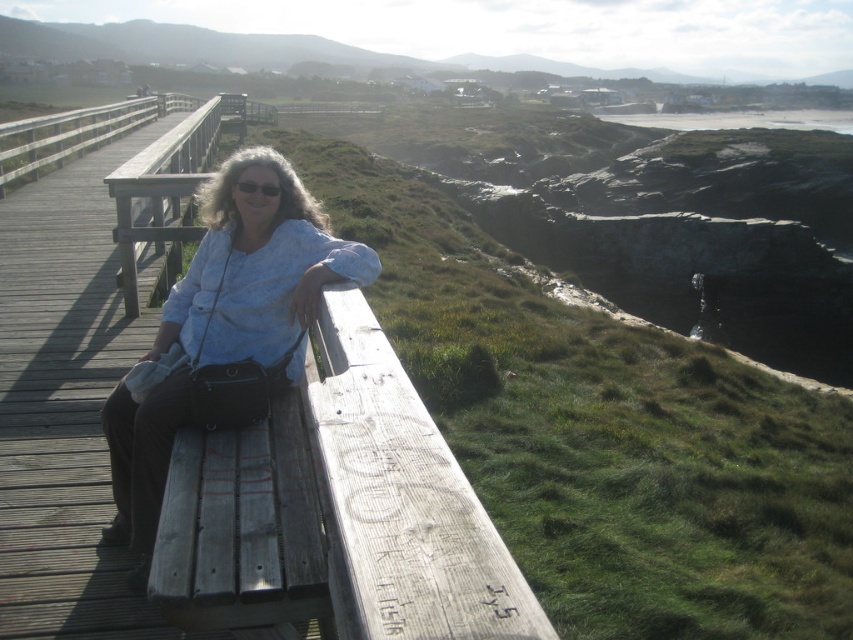
You are standing at the origin point of the boardwalk and want to reach the weathered wood bench at left. Which direction should you move in to get there?

The weathered wood bench at left is located at point 0.800 on the x axis and 0.396 on the y axis, so you should move towards the northeast direction to reach it.

You are a photographer trying to capture a portrait of the person in the matte blue shirt at center and the wooden at left. Since you want to ensure both subjects are in focus, which one should you focus on first to account for their sizes?

The matte blue shirt at center is thinner than the wooden at left, so you should focus on the wooden at left first because it is larger and requires more precise focus to ensure clarity.